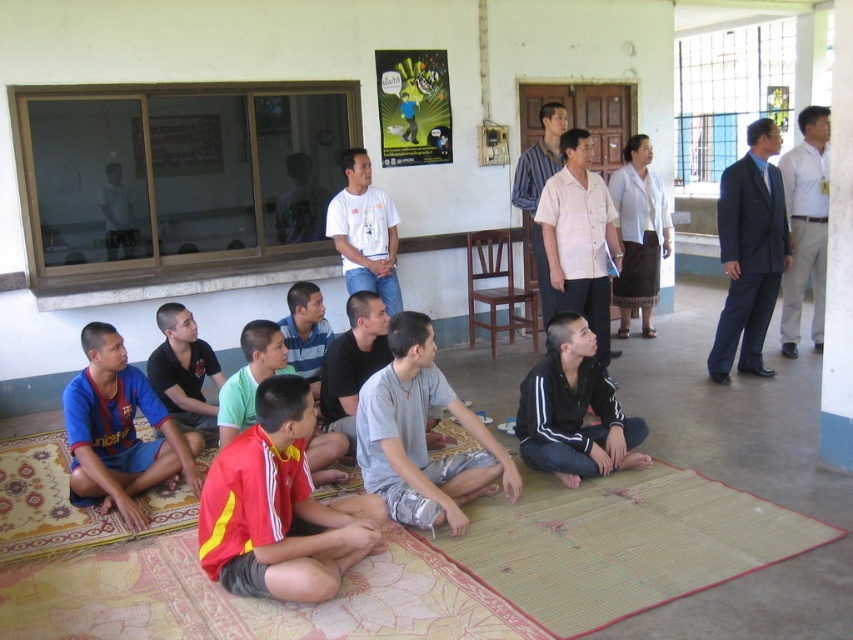
Question: Estimate the real-world distances between objects in this image. Which object is closer to the striped cotton shirt at center?

Choices:
 (A) natural bamboo mat at lower center
 (B) blue jersey at lower left
 (C) light beige shirt at center
 (D) white matte shirt at center

Answer: (C)

Question: Estimate the real-world distances between objects in this image. Which object is farther from the dark blue suit at right?

Choices:
 (A) light beige shirt at center
 (B) natural bamboo mat at lower center
 (C) textured beige mat at lower center

Answer: (C)

Question: Is white woven skirt at center wider than striped cotton shirt at center?

Choices:
 (A) no
 (B) yes

Answer: (B)

Question: Which point appears closest to the camera in this image?

Choices:
 (A) (741, 232)
 (B) (77, 422)
 (C) (80, 515)

Answer: (B)

Question: Does patterned carpet at lower left have a lesser width compared to striped cotton shirt at center?

Choices:
 (A) yes
 (B) no

Answer: (B)

Question: Is white shirt at upper right positioned behind striped cotton shirt at center?

Choices:
 (A) yes
 (B) no

Answer: (B)